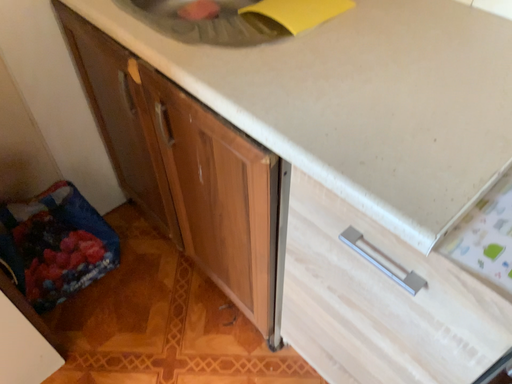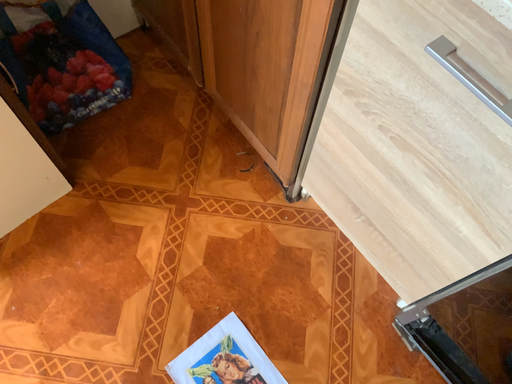
Question: How did the camera likely rotate when shooting the video?

Choices:
 (A) rotated downward
 (B) rotated upward

Answer: (A)